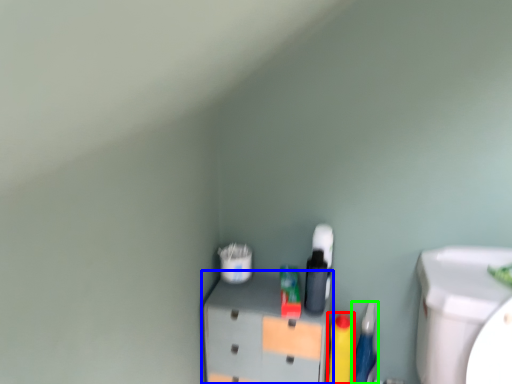
Question: Estimate the real-world distances between objects in this image. Which object is closer to cleaning product (highlighted by a red box), furniture (highlighted by a blue box) or stationery (highlighted by a green box)?

Choices:
 (A) furniture
 (B) stationery

Answer: (B)